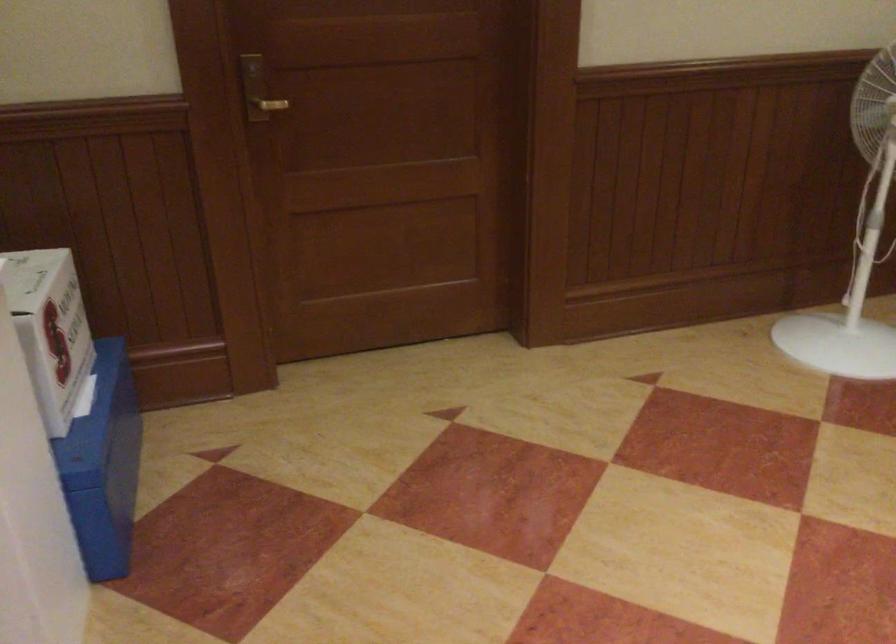
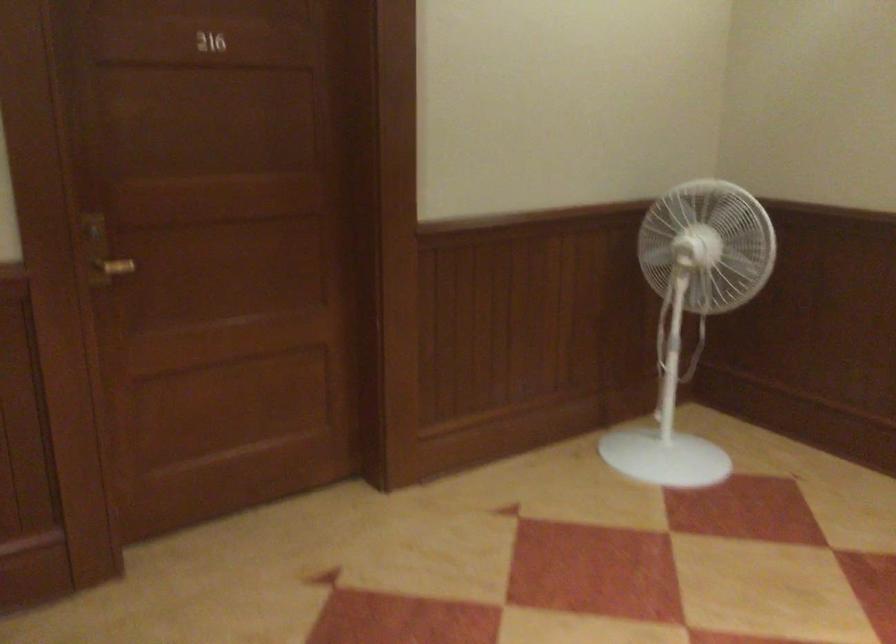
Find the pixel in the second image that matches point (256, 89) in the first image.

(101, 252)